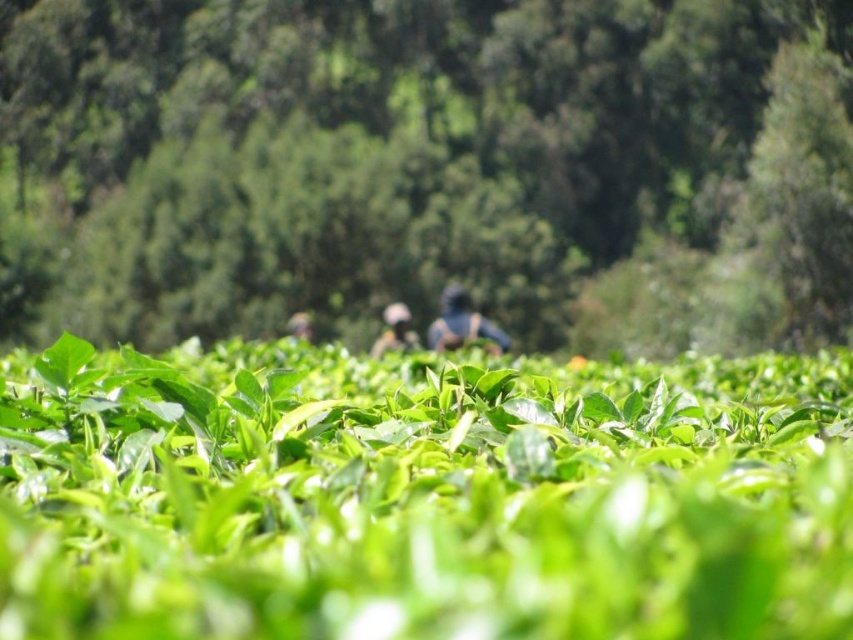
Question: Estimate the real-world distances between objects in this image. Which object is farther from the green leafy field at center?

Choices:
 (A) matte blue shirt at center
 (B) green leafy plant at center

Answer: (B)

Question: Does green leafy field at center have a larger size compared to matte blue shirt at center?

Choices:
 (A) no
 (B) yes

Answer: (A)

Question: Which object appears farthest from the camera in this image?

Choices:
 (A) matte blue shirt at center
 (B) green leafy plant at center
 (C) green leafy field at center

Answer: (B)

Question: Which is farther from the blue fabric at center?

Choices:
 (A) green leafy plant at center
 (B) matte blue shirt at center
 (C) green leafy field at center

Answer: (C)

Question: Can you confirm if green leafy field at center is thinner than matte blue shirt at center?

Choices:
 (A) no
 (B) yes

Answer: (B)

Question: Does blue fabric at center lie in front of matte blue shirt at center?

Choices:
 (A) yes
 (B) no

Answer: (A)